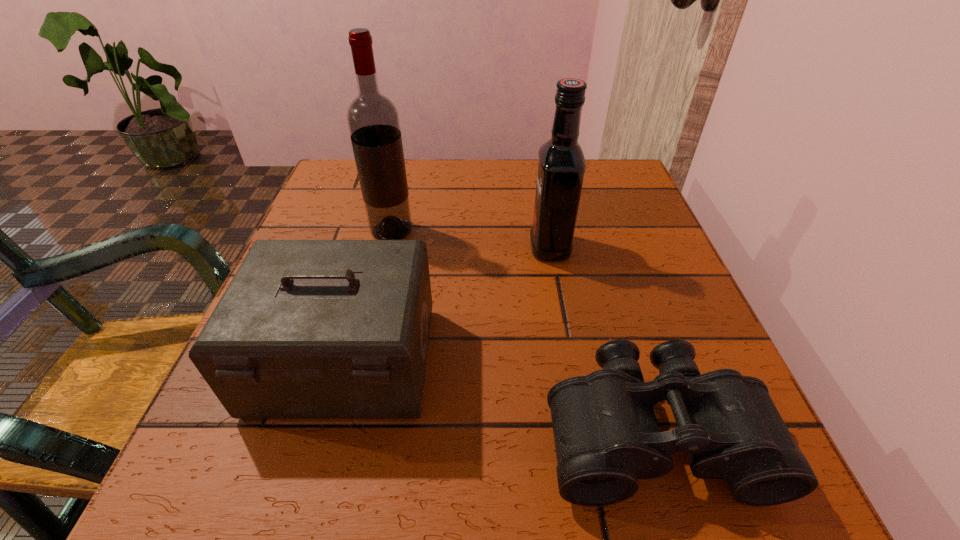
Select which object is the second closest to the shortest object. Please provide its 2D coordinates. Your answer should be formatted as a tuple, i.e. [(x, y)], where the tuple contains the x and y coordinates of a point satisfying the conditions above.

[(562, 165)]

Where is `blank area in the image that satisfies the following two spatial constraints: 1. on the back side of the wine bottle; 2. on the left side of the first-aid kit`? This screenshot has width=960, height=540. blank area in the image that satisfies the following two spatial constraints: 1. on the back side of the wine bottle; 2. on the left side of the first-aid kit is located at coordinates (380, 231).

Find the location of a particular element. blank space that satisfies the following two spatial constraints: 1. on the back side of the first-aid kit; 2. on the left side of the wine bottle is located at coordinates (380, 231).